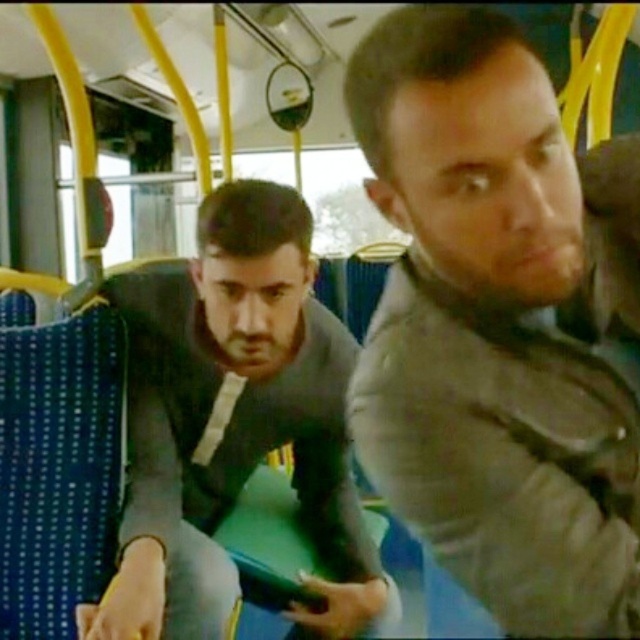
Consider the image. You are standing at the back of the bus and want to reach the front door. There is an obstacle at point (499, 324). What is blocking your path?

The gray fabric jacket at center is blocking your path at point (499, 324).

In the scene shown: You are a passenger on a public bus and you want to sit next to the gray fabric jacket at center and the gray matte jacket at center. Which of the two jackets would you choose if you want to sit closer to the aisle?

The gray fabric jacket at center has a lesser width compared to the gray matte jacket at center, so you should choose to sit next to the gray fabric jacket at center to be closer to the aisle.

You are a passenger on this bus and notice two jackets at the center. The gray fabric jacket at center and the gray matte jacket at center. Which jacket is on top of the other?

The gray fabric jacket at center is positioned over the gray matte jacket at center.